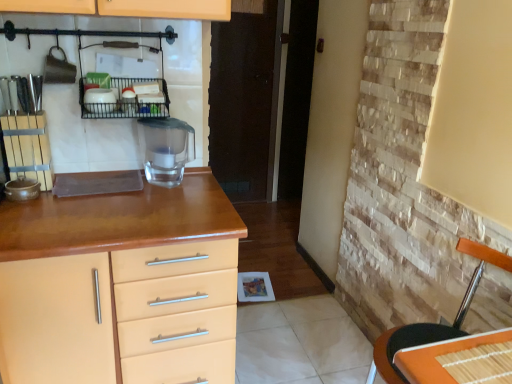
Question: Does orange woven mat at right have a greater width compared to black wire rack at upper center?

Choices:
 (A) yes
 (B) no

Answer: (A)

Question: Considering the relative sizes of orange woven mat at right and black wire rack at upper center in the image provided, is orange woven mat at right smaller than black wire rack at upper center?

Choices:
 (A) no
 (B) yes

Answer: (A)

Question: Is orange woven mat at right to the right of black wire rack at upper center from the viewer's perspective?

Choices:
 (A) yes
 (B) no

Answer: (A)

Question: Is orange woven mat at right with black wire rack at upper center?

Choices:
 (A) no
 (B) yes

Answer: (A)

Question: Considering the relative sizes of orange woven mat at right and black wire rack at upper center in the image provided, is orange woven mat at right shorter than black wire rack at upper center?

Choices:
 (A) yes
 (B) no

Answer: (B)

Question: Considering the relative positions of orange woven mat at right and black wire rack at upper center in the image provided, is orange woven mat at right to the left of black wire rack at upper center from the viewer's perspective?

Choices:
 (A) no
 (B) yes

Answer: (A)

Question: Does matte wood chest of drawers at left turn towards orange woven mat at right?

Choices:
 (A) no
 (B) yes

Answer: (A)

Question: From a real-world perspective, does matte wood chest of drawers at left sit lower than orange woven mat at right?

Choices:
 (A) yes
 (B) no

Answer: (A)

Question: Is the position of matte wood chest of drawers at left more distant than that of orange woven mat at right?

Choices:
 (A) yes
 (B) no

Answer: (A)

Question: Is matte wood chest of drawers at left in contact with orange woven mat at right?

Choices:
 (A) no
 (B) yes

Answer: (A)

Question: Considering the relative positions of matte wood chest of drawers at left and orange woven mat at right in the image provided, is matte wood chest of drawers at left to the right of orange woven mat at right from the viewer's perspective?

Choices:
 (A) yes
 (B) no

Answer: (B)

Question: Does matte wood chest of drawers at left appear on the left side of orange woven mat at right?

Choices:
 (A) no
 (B) yes

Answer: (B)

Question: From the image's perspective, is orange bamboo placemat at lower right beneath matte wood chest of drawers at left?

Choices:
 (A) no
 (B) yes

Answer: (A)